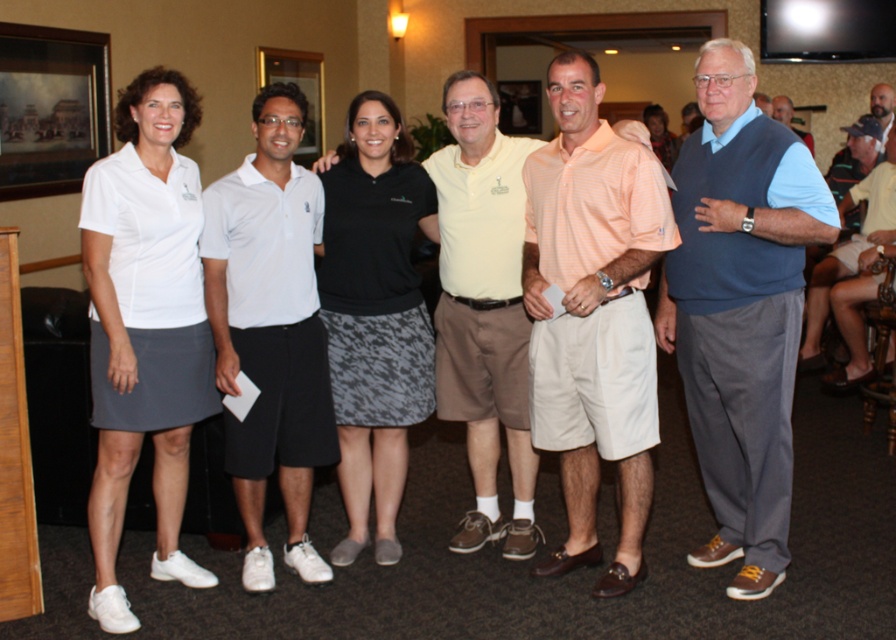
Which is more to the right, blue sweater at right or matte black skirt at center?

matte black skirt at center

The height and width of the screenshot is (640, 896). Describe the element at coordinates (739, 312) in the screenshot. I see `blue sweater at right` at that location.

Is point (761, 321) positioned in front of point (666, 138)?

Yes, it is in front of point (666, 138).

Where is `blue sweater at right`? This screenshot has height=640, width=896. blue sweater at right is located at coordinates (739, 312).

From the picture: Who is positioned more to the left, white matte skirt at left or blue sweater at center?

white matte skirt at left

Does white matte skirt at left appear on the right side of blue sweater at center?

Incorrect, white matte skirt at left is not on the right side of blue sweater at center.

Between point (154, 464) and point (806, 141), which one is positioned in front?

Point (154, 464) is in front.

Where is `white matte skirt at left`? white matte skirt at left is located at coordinates (145, 326).

Is matte black skirt at center further to camera compared to blue sweater at center?

Yes, it is.

Consider the image. Who is more distant from viewer, [670,132] or [773,99]?

Positioned behind is point [670,132].

Which is in front, point (665, 163) or point (778, 106)?

Point (778, 106) is more forward.

Identify the location of matte black skirt at center. Image resolution: width=896 pixels, height=640 pixels. (660, 134).